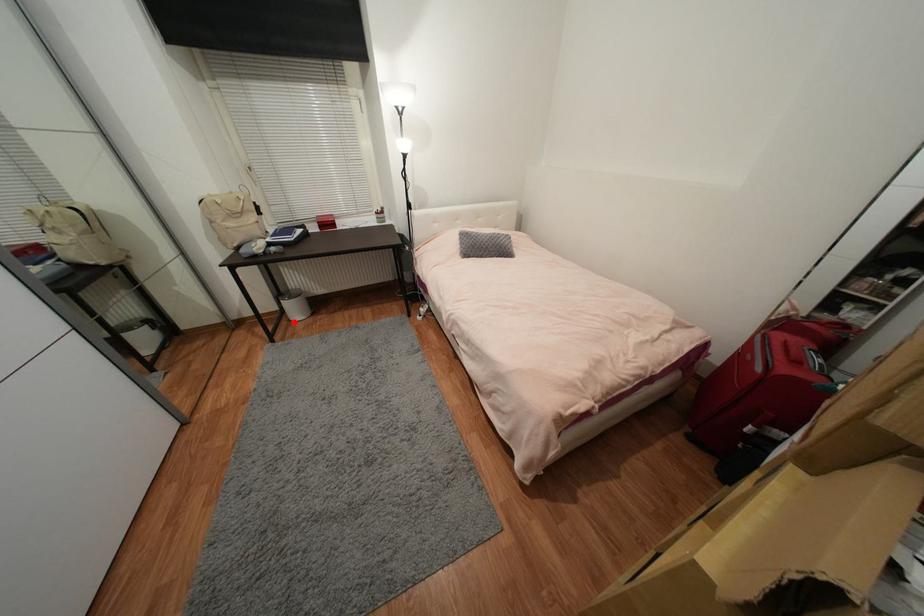
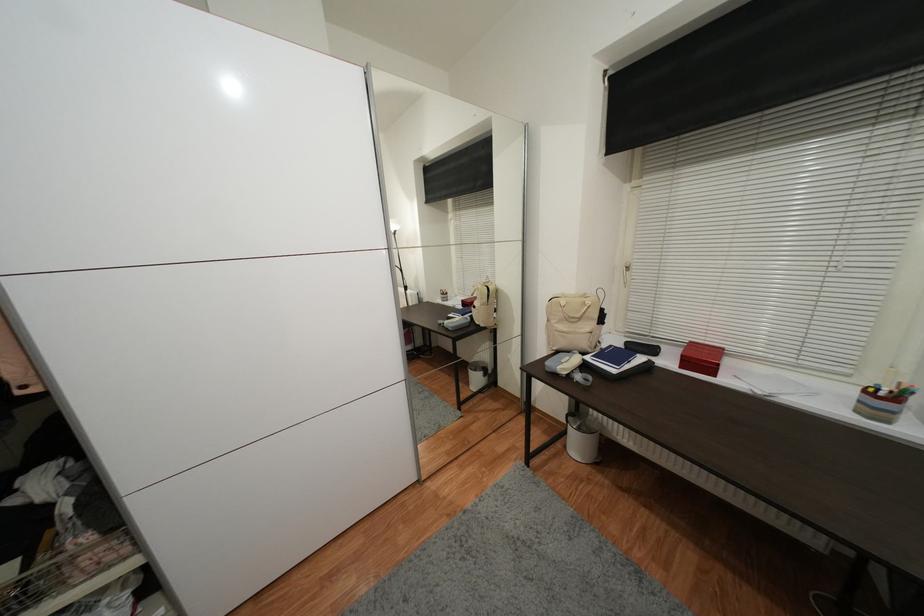
Find the pixel in the second image that matches the highlighted location in the first image.

(569, 448)